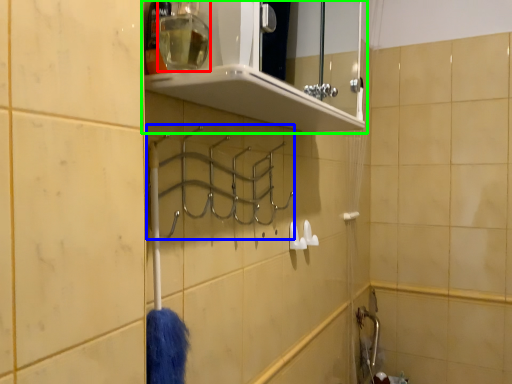
Question: Based on their relative distances, which object is nearer to toiletry (highlighted by a red box)? Choose from hanger (highlighted by a blue box) and shelf (highlighted by a green box).

Choices:
 (A) hanger
 (B) shelf

Answer: (A)